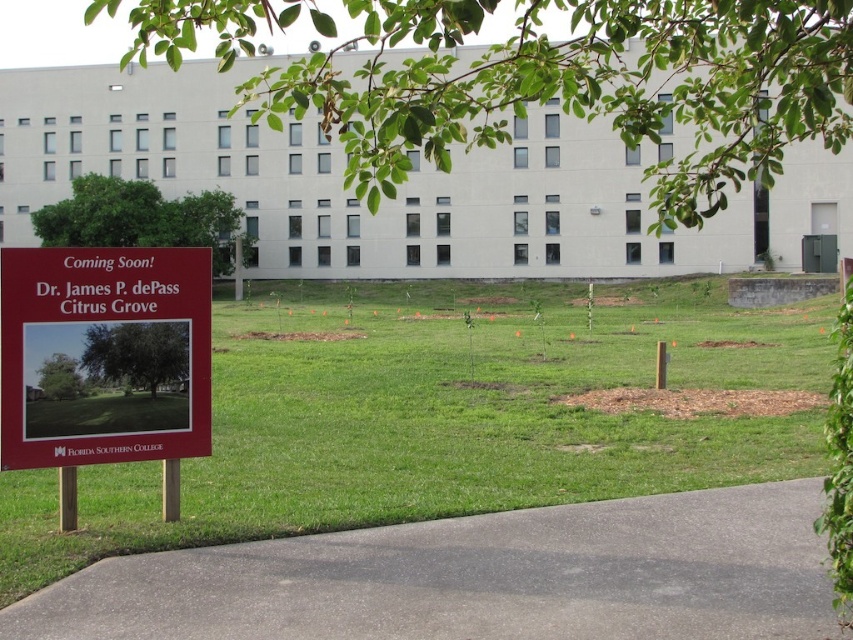
Question: Where is gray asphalt path at lower center located in relation to red matte sign at lower left in the image?

Choices:
 (A) right
 (B) left

Answer: (A)

Question: Does gray asphalt path at lower center have a smaller size compared to red matte sign at lower left?

Choices:
 (A) no
 (B) yes

Answer: (B)

Question: Can you confirm if gray asphalt path at lower center is positioned below red matte sign at lower left?

Choices:
 (A) yes
 (B) no

Answer: (A)

Question: Among these points, which one is farthest from the camera?

Choices:
 (A) (13, 301)
 (B) (776, 570)

Answer: (A)